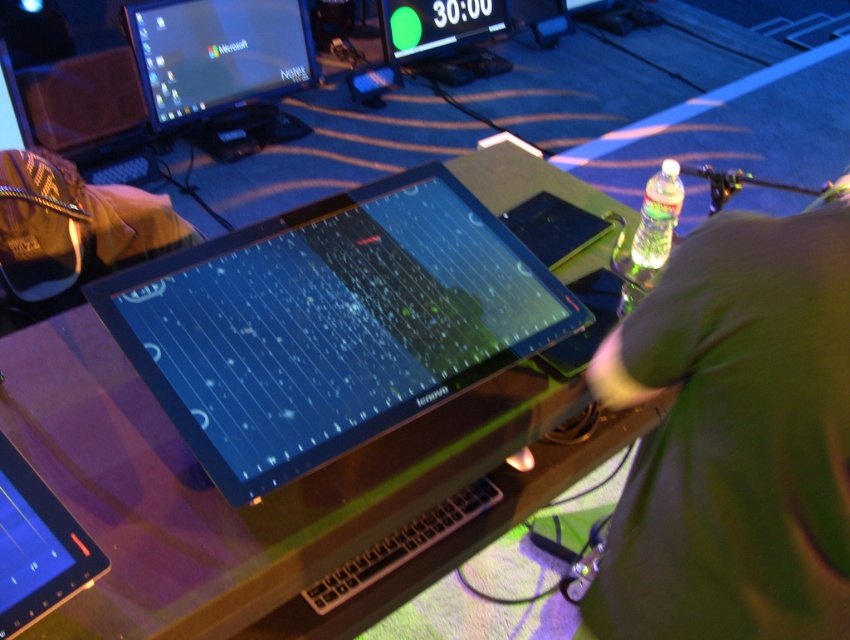
Question: Which object is the farthest from the matte black monitor at upper left?

Choices:
 (A) black glossy tablet at center
 (B) black glossy tablet at lower left
 (C) matte black laptop at center

Answer: (B)

Question: Which point is closer to the camera?

Choices:
 (A) black glossy tablet at center
 (B) matte black monitor at upper center
 (C) green fabric shirt at lower right

Answer: (C)

Question: Is green fabric shirt at lower right positioned behind black glossy tablet at center?

Choices:
 (A) yes
 (B) no

Answer: (B)

Question: Which is farther from the black glossy tablet at lower left?

Choices:
 (A) green fabric shirt at lower right
 (B) black glossy tablet at center
 (C) matte black laptop at center

Answer: (B)

Question: Can you confirm if green fabric shirt at lower right is positioned below matte black monitor at upper center?

Choices:
 (A) yes
 (B) no

Answer: (A)

Question: From the image, what is the correct spatial relationship of green fabric shirt at lower right in relation to matte black laptop at center?

Choices:
 (A) right
 (B) left

Answer: (A)